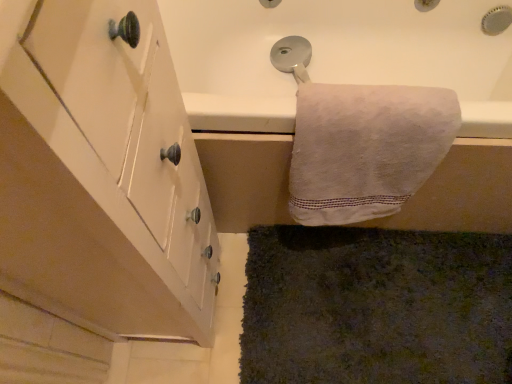
Question: Looking at the image, does white matte cabinet at left seem bigger or smaller compared to white cotton towel at upper right?

Choices:
 (A) small
 (B) big

Answer: (B)

Question: Is white matte cabinet at left situated inside white cotton towel at upper right or outside?

Choices:
 (A) inside
 (B) outside

Answer: (B)

Question: Based on their relative distances, which object is nearer to the dark green shaggy carpet at lower right?

Choices:
 (A) white cotton towel at upper right
 (B) white matte cabinet at left

Answer: (A)

Question: Estimate the real-world distances between objects in this image. Which object is closer to the dark green shaggy carpet at lower right?

Choices:
 (A) white matte cabinet at left
 (B) white cotton towel at upper right

Answer: (B)